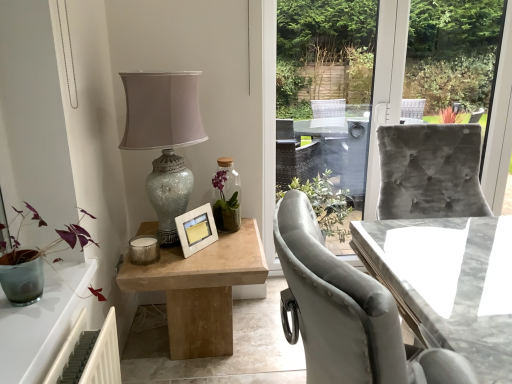
Question: Considering the positions of natural wood table at center, arranged as the 1th table when viewed from the left, and velvet grey chair at right in the image, is natural wood table at center, arranged as the 1th table when viewed from the left, wider or thinner than velvet grey chair at right?

Choices:
 (A) thin
 (B) wide

Answer: (B)

Question: From the image's perspective, is natural wood table at center, positioned as the 2th table in right-to-left order, located above or below velvet grey chair at right?

Choices:
 (A) above
 (B) below

Answer: (B)

Question: Which object is the farthest from the natural wood table at center, arranged as the 1th table when viewed from the left?

Choices:
 (A) crackle glass lampshade at upper left
 (B) velvet grey chair at right
 (C) white matte picture frame at center
 (D) purple matte plant at left
 (E) marble table at right, which ranks as the 1th table in right-to-left order

Answer: (B)

Question: Estimate the real-world distances between objects in this image. Which object is farther from the white matte picture frame at center?

Choices:
 (A) velvet grey chair at right
 (B) purple matte plant at left
 (C) natural wood table at center, positioned as the 2th table in right-to-left order
 (D) crackle glass lampshade at upper left
 (E) marble table at right, which ranks as the second table in left-to-right order

Answer: (A)